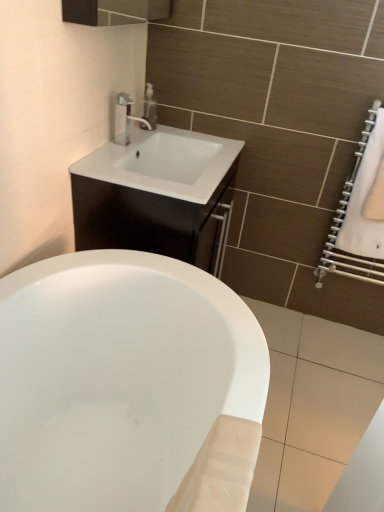
Question: Is satin nickel faucet at upper center to the left of white fabric towel at right from the viewer's perspective?

Choices:
 (A) no
 (B) yes

Answer: (B)

Question: Would you say satin nickel faucet at upper center is a long distance from white fabric towel at right?

Choices:
 (A) no
 (B) yes

Answer: (A)

Question: Is satin nickel faucet at upper center positioned with its back to white fabric towel at right?

Choices:
 (A) no
 (B) yes

Answer: (A)

Question: Is satin nickel faucet at upper center thinner than white fabric towel at right?

Choices:
 (A) yes
 (B) no

Answer: (B)

Question: Is white fabric towel at right surrounded by satin nickel faucet at upper center?

Choices:
 (A) no
 (B) yes

Answer: (A)

Question: Based on their positions, is satin nickel faucet at upper center located to the left or right of matte silver soap dispenser at upper center?

Choices:
 (A) right
 (B) left

Answer: (B)

Question: Do you think satin nickel faucet at upper center is within matte silver soap dispenser at upper center, or outside of it?

Choices:
 (A) outside
 (B) inside

Answer: (A)

Question: Looking at their shapes, would you say satin nickel faucet at upper center is wider or thinner than matte silver soap dispenser at upper center?

Choices:
 (A) thin
 (B) wide

Answer: (B)

Question: From their relative heights in the image, would you say satin nickel faucet at upper center is taller or shorter than matte silver soap dispenser at upper center?

Choices:
 (A) short
 (B) tall

Answer: (B)

Question: Is matte silver soap dispenser at upper center taller or shorter than white glossy cabinet at upper center?

Choices:
 (A) tall
 (B) short

Answer: (B)

Question: Looking at the image, does matte silver soap dispenser at upper center seem bigger or smaller compared to white glossy cabinet at upper center?

Choices:
 (A) big
 (B) small

Answer: (B)

Question: Would you say matte silver soap dispenser at upper center is inside or outside white glossy cabinet at upper center?

Choices:
 (A) outside
 (B) inside

Answer: (A)

Question: Considering their positions, is matte silver soap dispenser at upper center located in front of or behind white glossy cabinet at upper center?

Choices:
 (A) front
 (B) behind

Answer: (B)

Question: Is point (147, 125) closer or farther from the camera than point (360, 180)?

Choices:
 (A) farther
 (B) closer

Answer: (A)

Question: Is matte silver soap dispenser at upper center taller or shorter than white fabric towel at right?

Choices:
 (A) short
 (B) tall

Answer: (A)